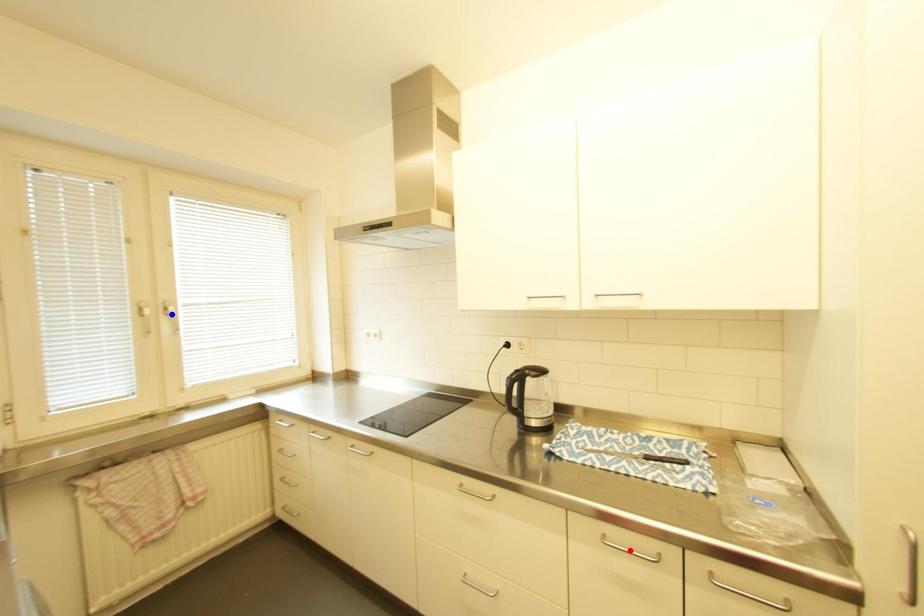
Question: Which of the two points in the image is closer to the camera?

Choices:
 (A) Blue point is closer.
 (B) Red point is closer.

Answer: (B)